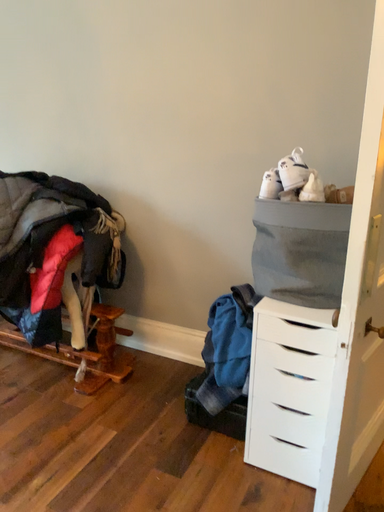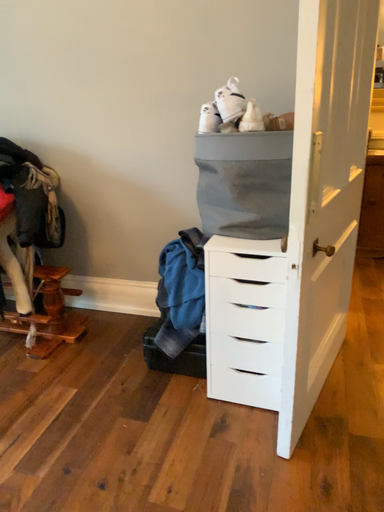
Question: How did the camera likely rotate when shooting the video?

Choices:
 (A) rotated left
 (B) rotated right

Answer: (B)